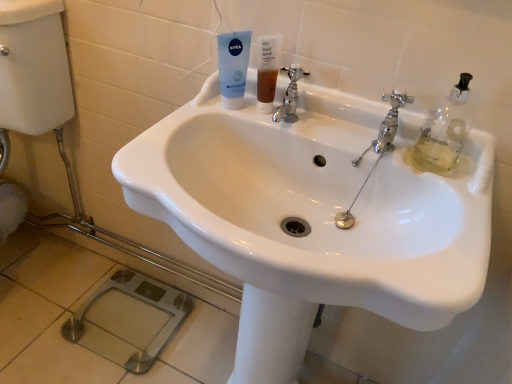
Question: Is chrome metallic faucet at upper right, the first tap from the right, not within chrome metallic faucet at center, which is the 2th tap in right-to-left order?

Choices:
 (A) yes
 (B) no

Answer: (A)

Question: From the image's perspective, is chrome metallic faucet at upper right, which ranks as the 2th tap in left-to-right order, located above chrome metallic faucet at center, which is the 2th tap in right-to-left order?

Choices:
 (A) no
 (B) yes

Answer: (A)

Question: Is chrome metallic faucet at upper right, which ranks as the 2th tap in left-to-right order, aimed at chrome metallic faucet at center, which is the 2th tap in right-to-left order?

Choices:
 (A) no
 (B) yes

Answer: (A)

Question: Is chrome metallic faucet at upper right, which ranks as the 2th tap in left-to-right order, further to the viewer compared to chrome metallic faucet at center, which is the 2th tap in right-to-left order?

Choices:
 (A) yes
 (B) no

Answer: (B)

Question: Is the depth of chrome metallic faucet at upper right, which ranks as the 2th tap in left-to-right order, less than that of chrome metallic faucet at center, which ranks as the 1th tap in left-to-right order?

Choices:
 (A) yes
 (B) no

Answer: (A)

Question: Considering the relative sizes of chrome metallic faucet at upper right, the first tap from the right, and chrome metallic faucet at center, which ranks as the 1th tap in left-to-right order, in the image provided, is chrome metallic faucet at upper right, the first tap from the right, bigger than chrome metallic faucet at center, which ranks as the 1th tap in left-to-right order,?

Choices:
 (A) no
 (B) yes

Answer: (A)

Question: From a real-world perspective, is white glossy sink at center beneath chrome metallic faucet at center, which is the 2th tap in right-to-left order?

Choices:
 (A) yes
 (B) no

Answer: (A)

Question: Does white glossy sink at center have a lesser width compared to chrome metallic faucet at center, which ranks as the 1th tap in left-to-right order?

Choices:
 (A) no
 (B) yes

Answer: (A)

Question: From the image's perspective, is white glossy sink at center under chrome metallic faucet at center, which ranks as the 1th tap in left-to-right order?

Choices:
 (A) no
 (B) yes

Answer: (B)

Question: Considering the relative positions of white glossy sink at center and chrome metallic faucet at center, which ranks as the 1th tap in left-to-right order, in the image provided, is white glossy sink at center behind chrome metallic faucet at center, which ranks as the 1th tap in left-to-right order,?

Choices:
 (A) no
 (B) yes

Answer: (A)

Question: Would you say white glossy sink at center is a long distance from chrome metallic faucet at center, which ranks as the 1th tap in left-to-right order?

Choices:
 (A) no
 (B) yes

Answer: (A)

Question: Does white glossy sink at center have a smaller size compared to chrome metallic faucet at center, which ranks as the 1th tap in left-to-right order?

Choices:
 (A) yes
 (B) no

Answer: (B)

Question: Is chrome metallic faucet at center, which ranks as the 1th tap in left-to-right order, oriented towards white glossy sink at center?

Choices:
 (A) no
 (B) yes

Answer: (A)